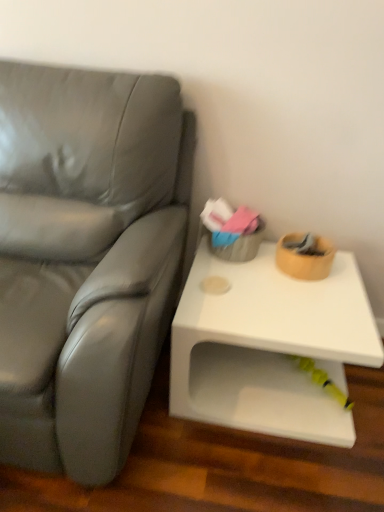
Question: Based on their sizes in the image, would you say white glossy table at right is bigger or smaller than matte gray couch at left?

Choices:
 (A) small
 (B) big

Answer: (A)

Question: Is white glossy table at right wider or thinner than matte gray couch at left?

Choices:
 (A) thin
 (B) wide

Answer: (A)

Question: Considering the positions of point (291, 437) and point (92, 327), is point (291, 437) closer or farther from the camera than point (92, 327)?

Choices:
 (A) farther
 (B) closer

Answer: (A)

Question: From a real-world perspective, relative to white glossy table at right, is matte gray couch at left vertically above or below?

Choices:
 (A) above
 (B) below

Answer: (A)

Question: Visually, is matte gray couch at left positioned to the left or to the right of white glossy table at right?

Choices:
 (A) left
 (B) right

Answer: (A)

Question: Considering their positions, is matte gray couch at left located in front of or behind white glossy table at right?

Choices:
 (A) behind
 (B) front

Answer: (B)

Question: Considering the positions of matte gray couch at left and white glossy table at right in the image, is matte gray couch at left bigger or smaller than white glossy table at right?

Choices:
 (A) small
 (B) big

Answer: (B)